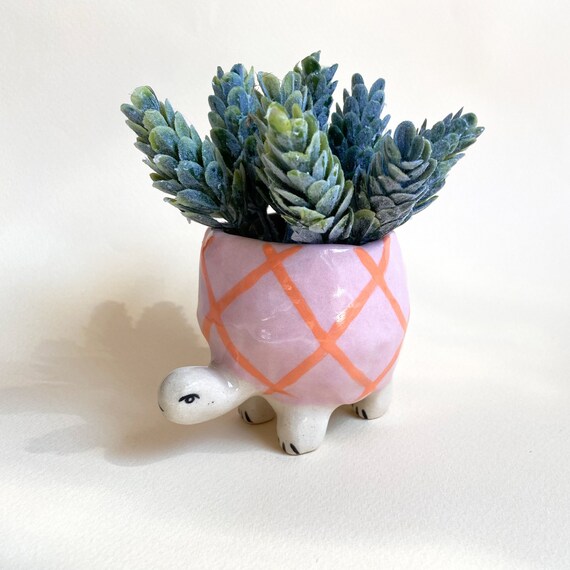
Locate an element on the screen. pink and orange shell pot is located at coordinates (259, 333), (302, 304).